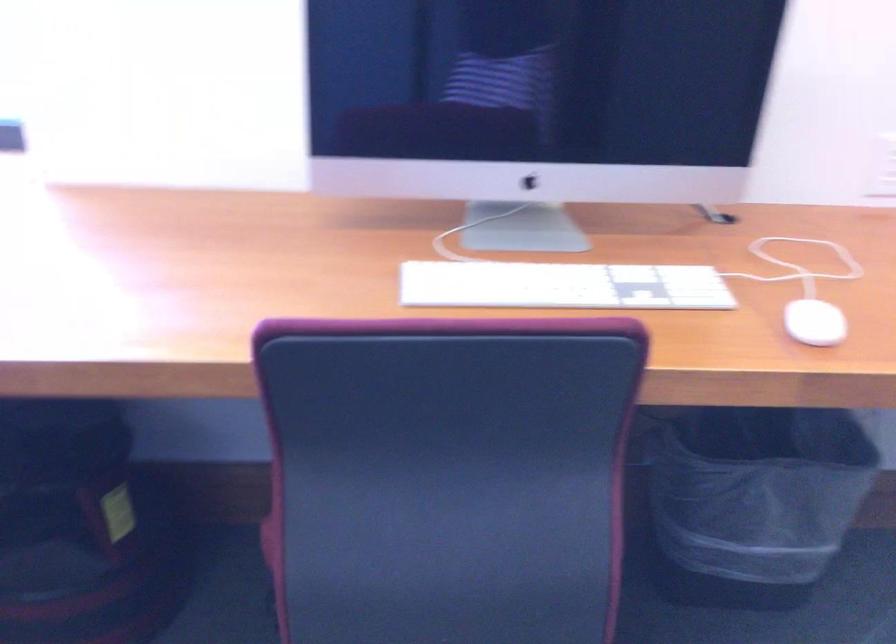
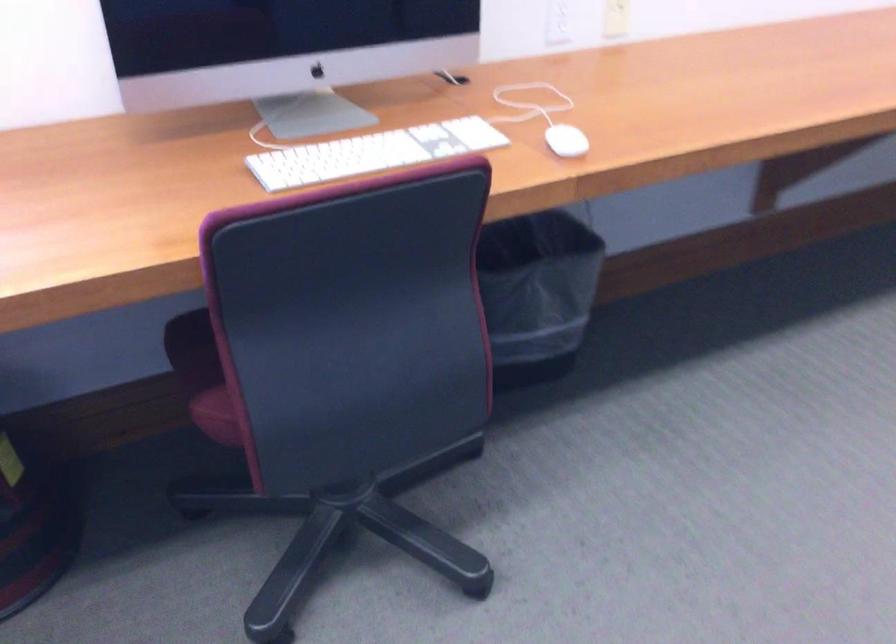
Where in the second image is the point corresponding to (x=762, y=500) from the first image?

(536, 292)